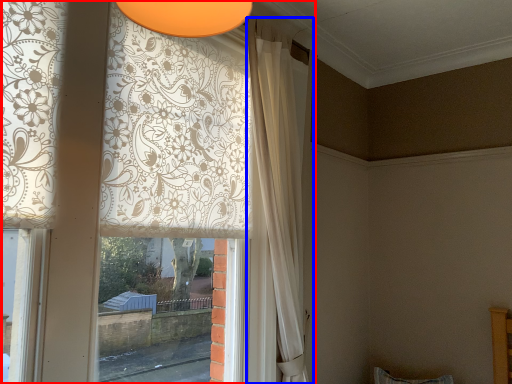
Question: Which of the following is the closest to the observer, curtain (highlighted by a red box) or curtain (highlighted by a blue box)?

Choices:
 (A) curtain
 (B) curtain

Answer: (A)